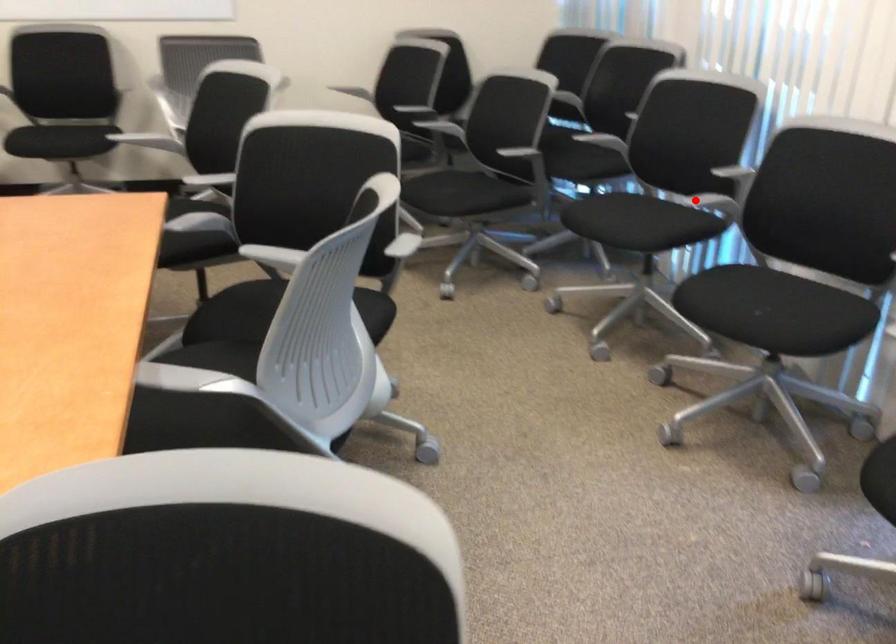
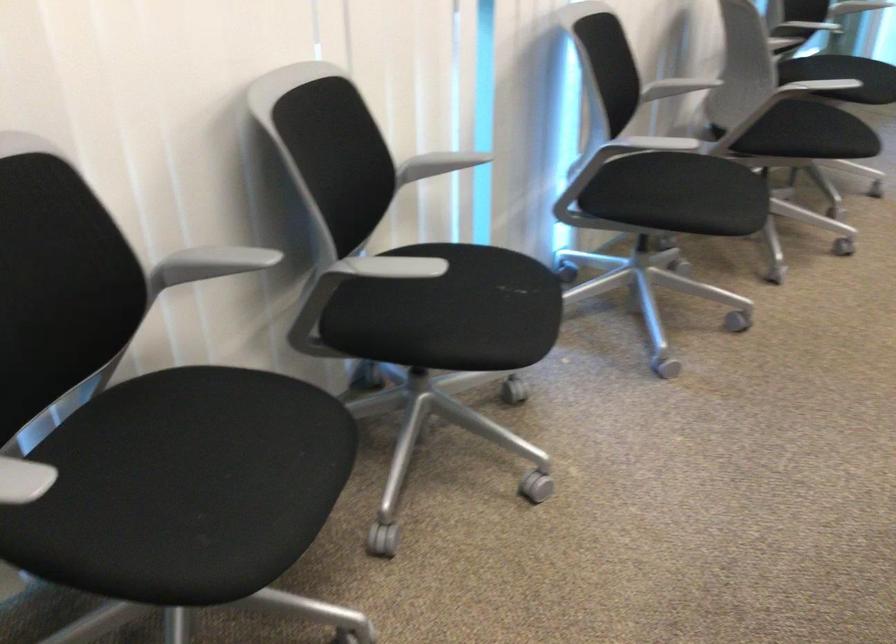
Question: A red point is marked in image1. In image2, is the corresponding 3D point closer to the camera or farther? Reply with the corresponding letter.

Choices:
 (A) The corresponding 3D point is closer.
 (B) The corresponding 3D point is farther.

Answer: (A)